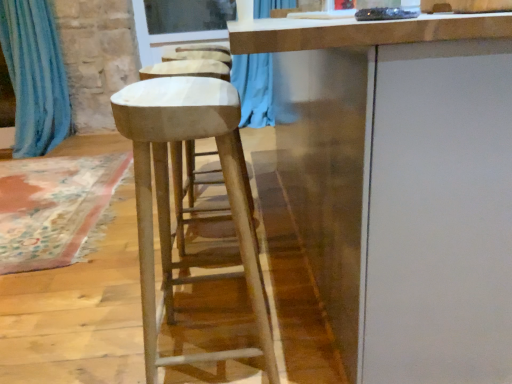
Question: From the image's perspective, is white matte cabinet at center below smooth white stool at center?

Choices:
 (A) yes
 (B) no

Answer: (B)

Question: From a real-world perspective, is white matte cabinet at center positioned over smooth white stool at center based on gravity?

Choices:
 (A) yes
 (B) no

Answer: (A)

Question: Is white matte cabinet at center thinner than smooth white stool at center?

Choices:
 (A) no
 (B) yes

Answer: (A)

Question: Is white matte cabinet at center next to smooth white stool at center?

Choices:
 (A) yes
 (B) no

Answer: (B)

Question: Is smooth white stool at center at the back of white matte cabinet at center?

Choices:
 (A) yes
 (B) no

Answer: (B)

Question: Is transparent glass window screen at upper center in front of or behind smooth white stool at center in the image?

Choices:
 (A) front
 (B) behind

Answer: (B)

Question: Considering the positions of transparent glass window screen at upper center and smooth white stool at center in the image, is transparent glass window screen at upper center bigger or smaller than smooth white stool at center?

Choices:
 (A) small
 (B) big

Answer: (A)

Question: Would you say transparent glass window screen at upper center is to the left or to the right of smooth white stool at center in the picture?

Choices:
 (A) right
 (B) left

Answer: (B)

Question: From the image's perspective, relative to smooth white stool at center, is transparent glass window screen at upper center above or below?

Choices:
 (A) above
 (B) below

Answer: (A)

Question: Considering the positions of blue fabric curtain at left and transparent glass window screen at upper center in the image, is blue fabric curtain at left taller or shorter than transparent glass window screen at upper center?

Choices:
 (A) short
 (B) tall

Answer: (B)

Question: In the image, is blue fabric curtain at left positioned in front of or behind transparent glass window screen at upper center?

Choices:
 (A) behind
 (B) front

Answer: (B)

Question: From a real-world perspective, is blue fabric curtain at left above or below transparent glass window screen at upper center?

Choices:
 (A) above
 (B) below

Answer: (B)

Question: Considering the relative positions of blue fabric curtain at left and transparent glass window screen at upper center in the image provided, is blue fabric curtain at left to the left or to the right of transparent glass window screen at upper center?

Choices:
 (A) right
 (B) left

Answer: (B)

Question: Is smooth white stool at center in front of or behind blue fabric curtain at left in the image?

Choices:
 (A) behind
 (B) front

Answer: (B)

Question: Visually, is smooth white stool at center positioned to the left or to the right of blue fabric curtain at left?

Choices:
 (A) right
 (B) left

Answer: (A)